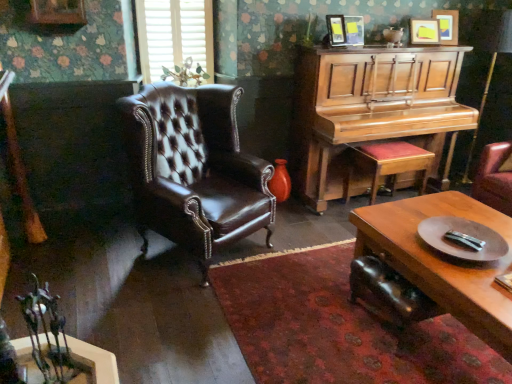
In order to click on vacant location behind wooden polished round table at lower right in this screenshot , I will do `click(418, 215)`.